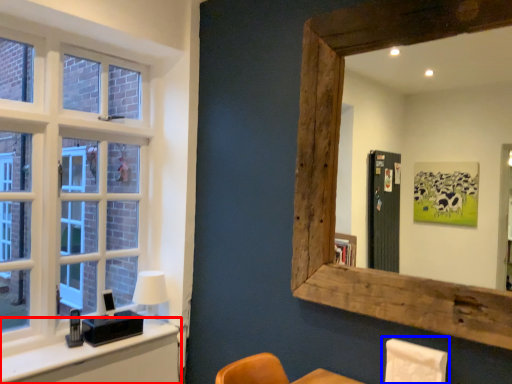
Question: Among these objects, which one is nearest to the camera, vanity (highlighted by a red box) or swivel chair (highlighted by a blue box)?

Choices:
 (A) vanity
 (B) swivel chair

Answer: (B)